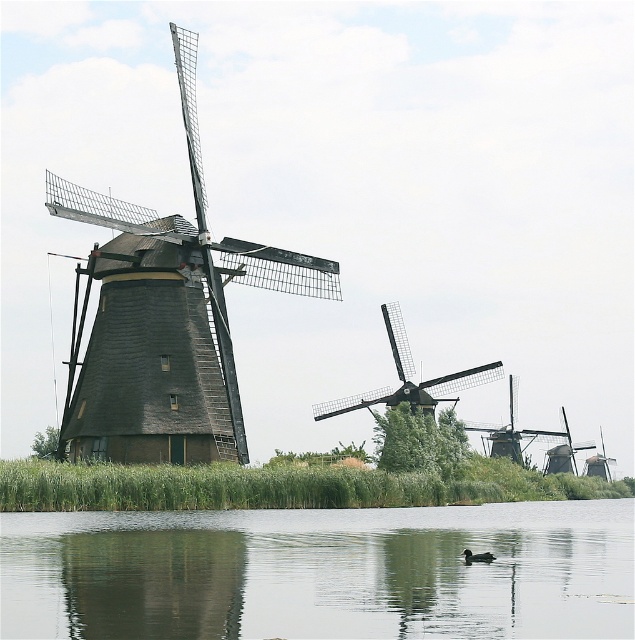
You are standing on the shore of the water and see the dark gray wooden windmill at left and the brown feathered duck at lower center. Which object is closer to your right side?

The brown feathered duck at lower center is closer to your right side because the dark gray wooden windmill at left is positioned to the left of it.

You are a birdwatcher observing the scene from the shore. You notice the dark brown wooden windmill at center and the brown feathered duck at lower center. Which object is positioned higher in the image?

The dark brown wooden windmill at center is located above the brown feathered duck at lower center, so it is positioned higher in the image.

You are a tourist standing at the water edge in the scene. You want to take a photo of both the dark gray wooden windmill at left and the dark brown wooden windmill at center. Which windmill should you zoom in more on to include both in the frame?

Since the dark gray wooden windmill at left is much taller than the dark brown wooden windmill at center, you should zoom in more on the dark gray wooden windmill at left to ensure both are visible in the photo.